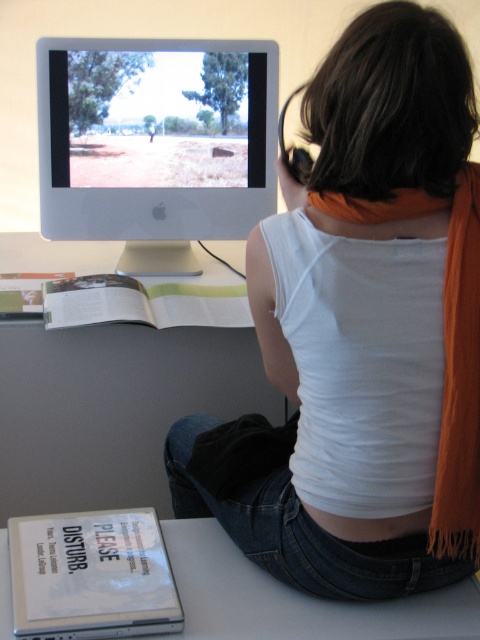
Is white glossy computer monitor at upper center shorter than white paper at lower left?

In fact, white glossy computer monitor at upper center may be taller than white paper at lower left.

Does white glossy computer monitor at upper center appear on the right side of white paper at lower left?

No, white glossy computer monitor at upper center is not to the right of white paper at lower left.

Is point (46, 97) positioned behind point (56, 609)?

That is True.

This screenshot has width=480, height=640. Identify the location of white glossy computer monitor at upper center. (156, 144).

Is white paper at lower left above orange fringed scarf at back?

Incorrect, white paper at lower left is not positioned above orange fringed scarf at back.

From the picture: Does white paper at lower left appear under orange fringed scarf at back?

Yes, white paper at lower left is below orange fringed scarf at back.

This screenshot has width=480, height=640. What are the coordinates of `white paper at lower left` in the screenshot? It's located at (x=91, y=576).

Between white matte tank top at center and white paper at lower left, which one appears on the right side from the viewer's perspective?

white matte tank top at center

Can you confirm if white matte tank top at center is thinner than white paper at lower left?

No, white matte tank top at center is not thinner than white paper at lower left.

Who is more distant from viewer, (436, 198) or (12, 589)?

Point (12, 589)

Image resolution: width=480 pixels, height=640 pixels. In order to click on white matte tank top at center in this screenshot , I will do `click(368, 328)`.